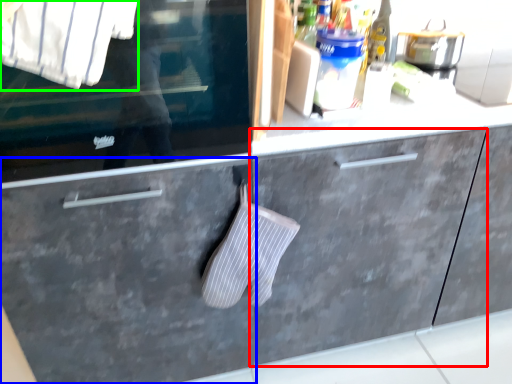
Question: Based on their relative distances, which object is farther from cabinetry (highlighted by a red box)? Choose from drawer (highlighted by a blue box) and shirt (highlighted by a green box).

Choices:
 (A) drawer
 (B) shirt

Answer: (B)